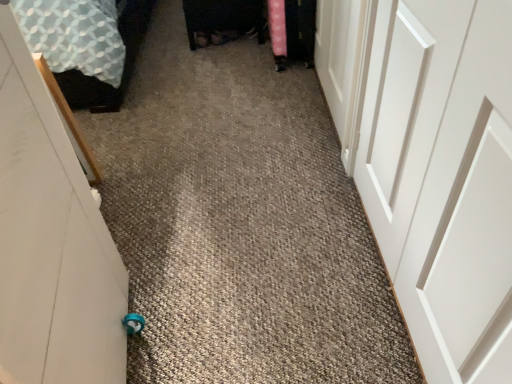
Where is `free space behind white smooth door at right, which is counted as the first door, starting from the right`? This screenshot has height=384, width=512. free space behind white smooth door at right, which is counted as the first door, starting from the right is located at coordinates (297, 188).